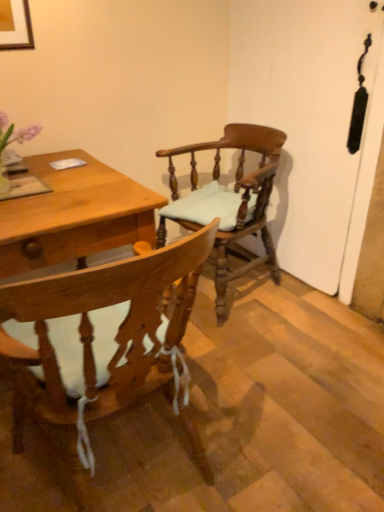
Question: Which direction should I rotate to look at wooden chair with cushion at center, placed as the second chair when sorted from front to back, — up or down?

Choices:
 (A) up
 (B) down

Answer: (A)

Question: Is wooden chair with white cushion at center, placed as the first chair when sorted from front to back, thinner than wooden chair with cushion at center, placed as the second chair when sorted from front to back?

Choices:
 (A) no
 (B) yes

Answer: (A)

Question: Can you confirm if wooden chair with white cushion at center, placed as the first chair when sorted from front to back, is smaller than wooden chair with cushion at center, which is counted as the 1th chair, starting from the back?

Choices:
 (A) yes
 (B) no

Answer: (A)

Question: From the image's perspective, does wooden chair with white cushion at center, the 2th chair viewed from the back, appear lower than wooden chair with cushion at center, placed as the second chair when sorted from front to back?

Choices:
 (A) yes
 (B) no

Answer: (A)

Question: Does wooden chair with white cushion at center, placed as the first chair when sorted from front to back, come behind wooden chair with cushion at center, placed as the second chair when sorted from front to back?

Choices:
 (A) no
 (B) yes

Answer: (A)

Question: Are wooden chair with white cushion at center, the 2th chair viewed from the back, and wooden chair with cushion at center, which is counted as the 1th chair, starting from the back, far apart?

Choices:
 (A) yes
 (B) no

Answer: (B)

Question: Is wooden chair with white cushion at center, placed as the first chair when sorted from front to back, bigger than wooden chair with cushion at center, which is counted as the 1th chair, starting from the back?

Choices:
 (A) no
 (B) yes

Answer: (A)

Question: Is wooden chair with cushion at center, placed as the second chair when sorted from front to back, touching wooden chair with white cushion at center, placed as the first chair when sorted from front to back?

Choices:
 (A) yes
 (B) no

Answer: (B)

Question: Does wooden chair with cushion at center, which is counted as the 1th chair, starting from the back, turn towards wooden chair with white cushion at center, placed as the first chair when sorted from front to back?

Choices:
 (A) yes
 (B) no

Answer: (A)

Question: Can you confirm if wooden chair with cushion at center, placed as the second chair when sorted from front to back, is positioned to the left of wooden chair with white cushion at center, the 2th chair viewed from the back?

Choices:
 (A) no
 (B) yes

Answer: (A)

Question: Is wooden chair with cushion at center, which is counted as the 1th chair, starting from the back, further to the viewer compared to wooden chair with white cushion at center, placed as the first chair when sorted from front to back?

Choices:
 (A) no
 (B) yes

Answer: (B)

Question: From a real-world perspective, is wooden chair with cushion at center, placed as the second chair when sorted from front to back, physically below wooden chair with white cushion at center, the 2th chair viewed from the back?

Choices:
 (A) no
 (B) yes

Answer: (B)

Question: Would you say wooden chair with cushion at center, which is counted as the 1th chair, starting from the back, contains wooden chair with white cushion at center, the 2th chair viewed from the back?

Choices:
 (A) yes
 (B) no

Answer: (B)

Question: Considering the positions of wooden chair with white cushion at center, the 2th chair viewed from the back, and wooden chair with cushion at center, which is counted as the 1th chair, starting from the back, in the image, is wooden chair with white cushion at center, the 2th chair viewed from the back, bigger or smaller than wooden chair with cushion at center, which is counted as the 1th chair, starting from the back,?

Choices:
 (A) big
 (B) small

Answer: (B)